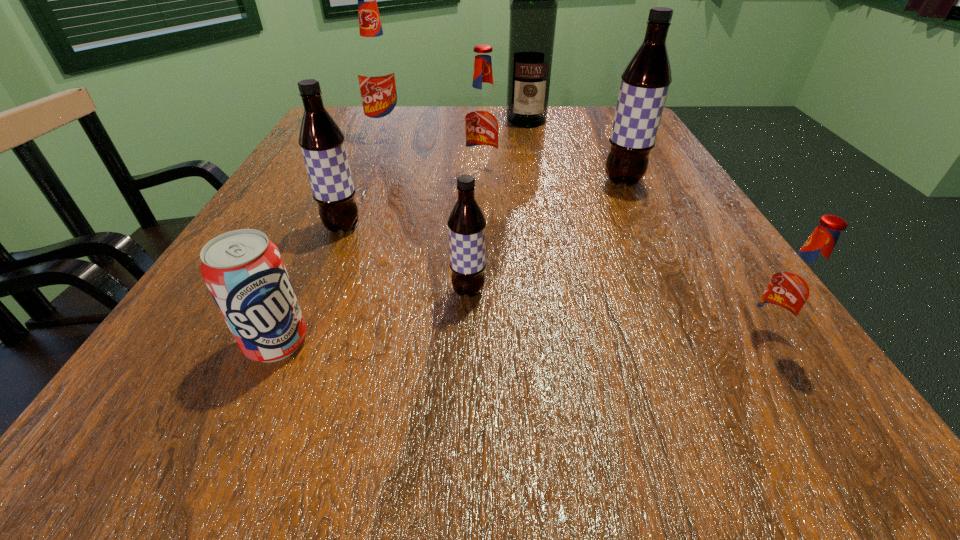
The image size is (960, 540). I want to click on free location that satisfies the following two spatial constraints: 1. on the front side of the second farthest brown root beer; 2. on the left side of the nearest root beer, so point(298,336).

Locate an element on the screen. free location that satisfies the following two spatial constraints: 1. on the back side of the second object from right to left; 2. on the left side of the shortest object is located at coordinates (349, 181).